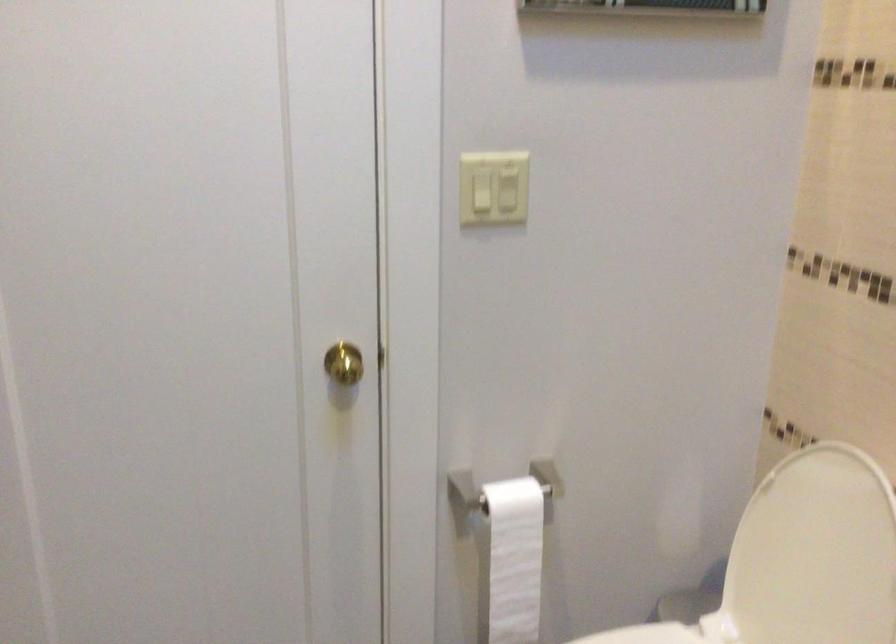
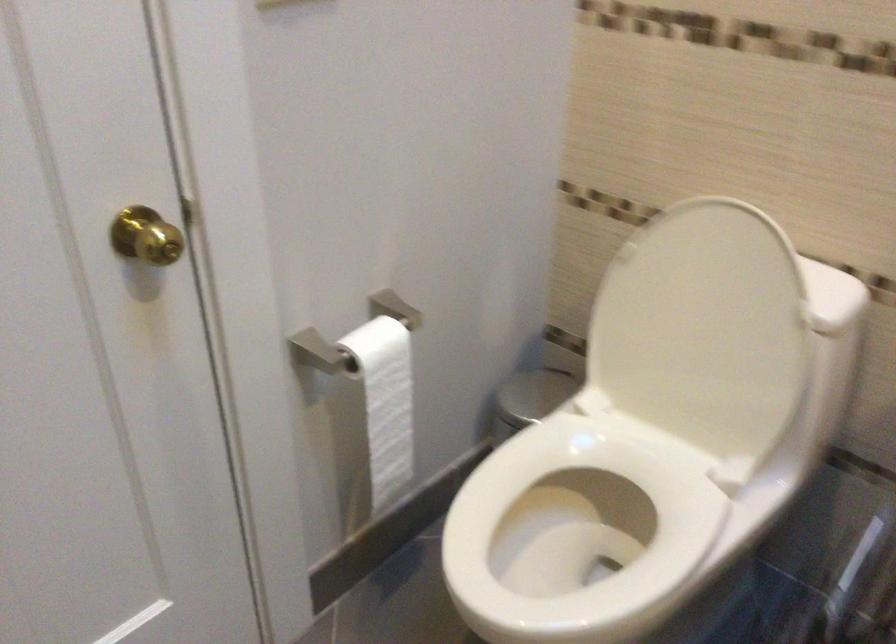
How did the camera likely rotate?

The camera rotated toward right-down.